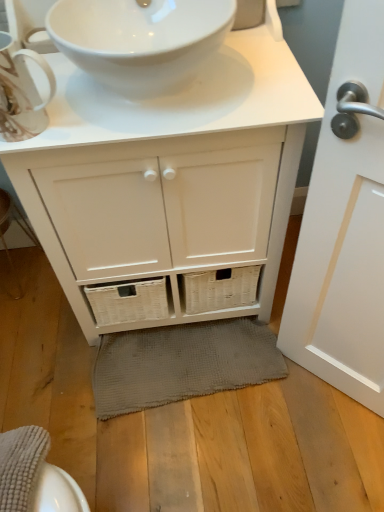
Question: Does gray textured bath mat at lower center lie behind white glossy door handle at right?

Choices:
 (A) no
 (B) yes

Answer: (B)

Question: Considering the relative sizes of gray textured bath mat at lower center and white glossy door handle at right in the image provided, is gray textured bath mat at lower center wider than white glossy door handle at right?

Choices:
 (A) no
 (B) yes

Answer: (B)

Question: Is gray textured bath mat at lower center not within white glossy door handle at right?

Choices:
 (A) yes
 (B) no

Answer: (A)

Question: Could you tell me if gray textured bath mat at lower center is turned towards white glossy door handle at right?

Choices:
 (A) yes
 (B) no

Answer: (B)

Question: From a real-world perspective, is gray textured bath mat at lower center located beneath white glossy door handle at right?

Choices:
 (A) no
 (B) yes

Answer: (B)

Question: Is white glossy sink at upper center inside the boundaries of gray textured bath mat at lower center, or outside?

Choices:
 (A) inside
 (B) outside

Answer: (B)

Question: Is white glossy sink at upper center to the left or to the right of gray textured bath mat at lower center in the image?

Choices:
 (A) left
 (B) right

Answer: (A)

Question: Considering their positions, is white glossy sink at upper center located in front of or behind gray textured bath mat at lower center?

Choices:
 (A) front
 (B) behind

Answer: (A)

Question: From a real-world perspective, is white glossy sink at upper center above or below gray textured bath mat at lower center?

Choices:
 (A) below
 (B) above

Answer: (B)

Question: Do you think white glossy sink at upper center is within matte white teacup at upper left, or outside of it?

Choices:
 (A) outside
 (B) inside

Answer: (A)

Question: Is white glossy sink at upper center to the left or to the right of matte white teacup at upper left in the image?

Choices:
 (A) left
 (B) right

Answer: (B)

Question: From a real-world perspective, is white glossy sink at upper center positioned above or below matte white teacup at upper left?

Choices:
 (A) below
 (B) above

Answer: (A)

Question: In the image, is white glossy sink at upper center positioned in front of or behind matte white teacup at upper left?

Choices:
 (A) behind
 (B) front

Answer: (A)

Question: Is white glossy door handle at right bigger or smaller than matte white teacup at upper left?

Choices:
 (A) big
 (B) small

Answer: (A)

Question: From their relative heights in the image, would you say white glossy door handle at right is taller or shorter than matte white teacup at upper left?

Choices:
 (A) tall
 (B) short

Answer: (A)